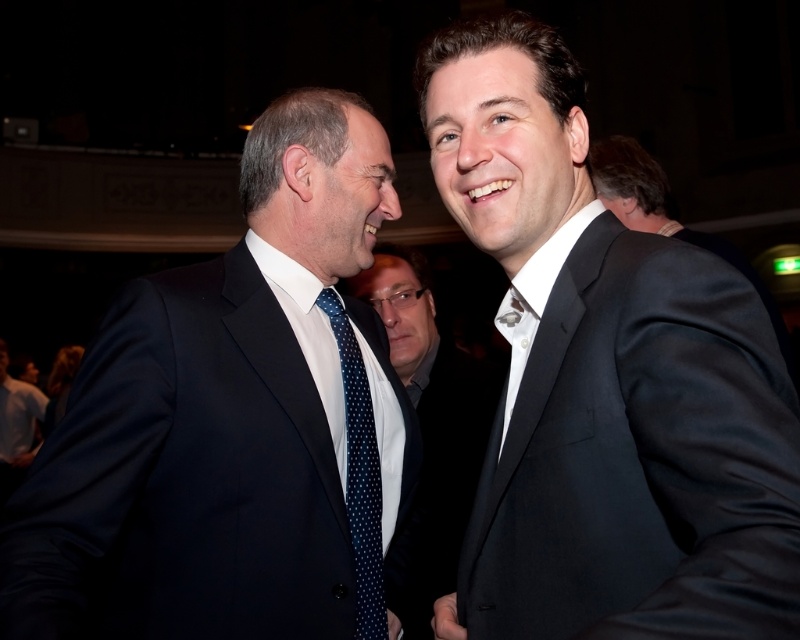
You are a photographer at a formal event. You notice two men in dark suits standing at the center of the image. They both have white shirts and ties. The man on the left has a polka dot tie at center, and the man on the right has a blue dotted tie at center. You want to capture a closeup of the tie that is closer to the camera. Which tie should you focus on?

The polka dot tie at center is positioned over the blue dotted tie at center, meaning it is closer to the camera. Therefore, to capture a closeup, focus on the polka dot tie at center.

Where is the black satin suit at center located in the image?

The black satin suit at center is located at point 0.597 on the x axis and 0.757 on the y axis.